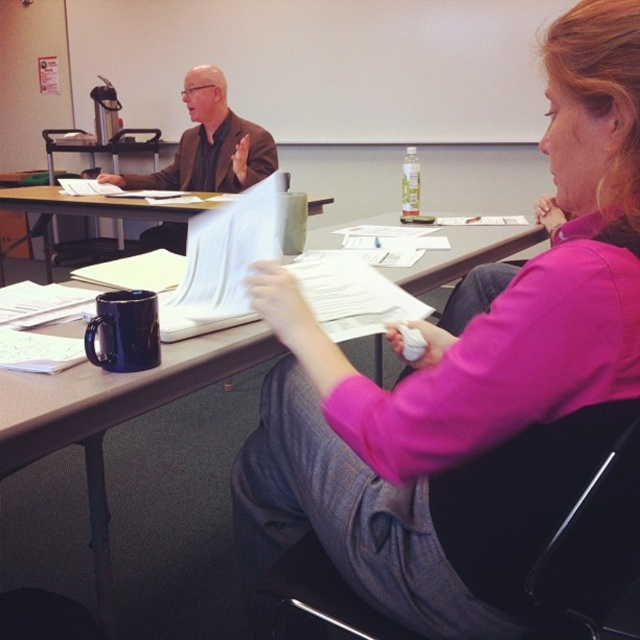
At what (x,y) coordinates should I click in order to perform the action: click on pink fabric shirt at center. Please return your answer as a coordinate pair (x, y). This screenshot has height=640, width=640. Looking at the image, I should click on (468, 388).

Who is more forward, (476,468) or (22,378)?

Point (476,468) is in front.

Find the location of a particular element. pink fabric shirt at center is located at coordinates (468, 388).

This screenshot has width=640, height=640. What do you see at coordinates (468, 388) in the screenshot?
I see `pink fabric shirt at center` at bounding box center [468, 388].

I want to click on pink fabric shirt at center, so click(x=468, y=388).

Where is `pink fabric shirt at center`? The image size is (640, 640). pink fabric shirt at center is located at coordinates (468, 388).

This screenshot has width=640, height=640. What do you see at coordinates (112, 419) in the screenshot?
I see `matte black mug at center` at bounding box center [112, 419].

Does matte black mug at center have a lesser height compared to white paper at center?

No.

Measure the distance between point (36, 385) and camera.

They are 81.06 centimeters apart.

This screenshot has height=640, width=640. I want to click on matte black mug at center, so click(112, 419).